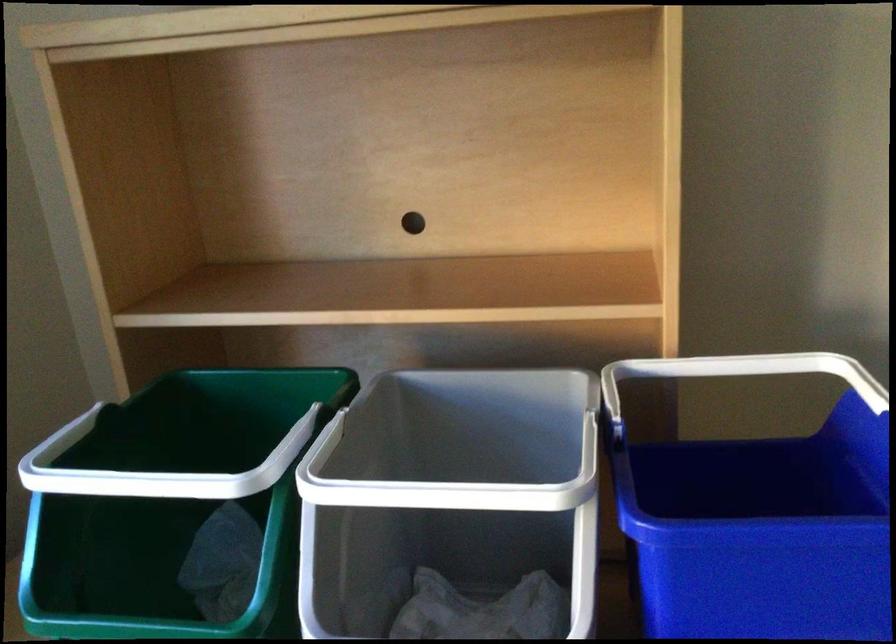
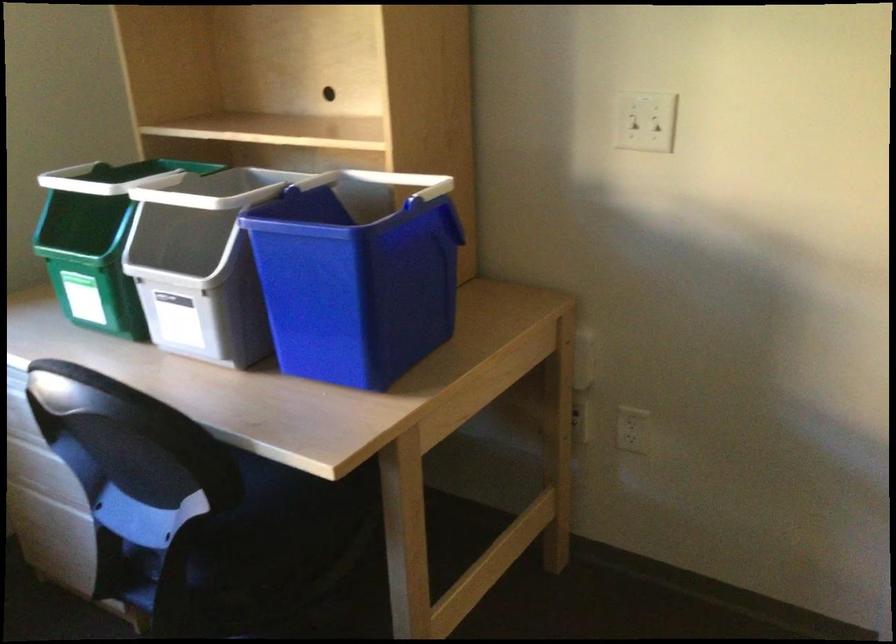
In the second image, find the point that corresponds to the point at 132,430 in the first image.

(116, 178)